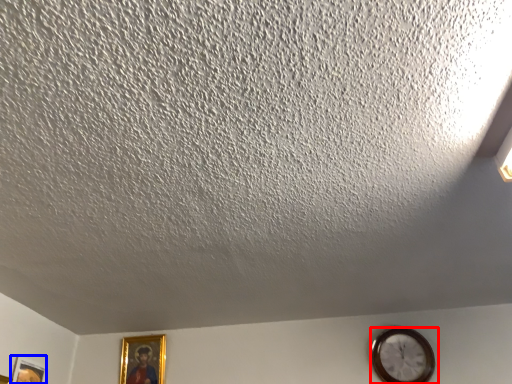
Question: Among these objects, which one is farthest to the camera, wall clock (highlighted by a red box) or picture frame (highlighted by a blue box)?

Choices:
 (A) wall clock
 (B) picture frame

Answer: (A)